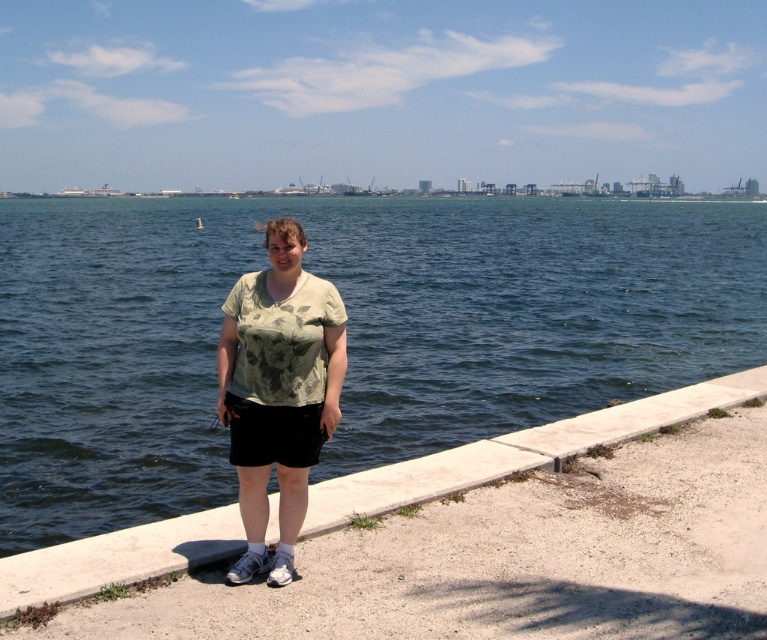
Is dark blue water at center closer to the viewer compared to concrete at center?

Yes.

Is dark blue water at center smaller than concrete at center?

Actually, dark blue water at center might be larger than concrete at center.

Who is more forward, (150, 445) or (713, 388)?

Point (713, 388)

The height and width of the screenshot is (640, 767). Find the location of `dark blue water at center`. dark blue water at center is located at coordinates (347, 332).

The height and width of the screenshot is (640, 767). What do you see at coordinates (347, 332) in the screenshot? I see `dark blue water at center` at bounding box center [347, 332].

In the scene shown: Which is above, dark blue water at center or green floral shirt at center?

dark blue water at center is higher up.

Is point (744, 324) less distant than point (236, 328)?

No, (744, 324) is further to viewer.

The image size is (767, 640). Identify the location of dark blue water at center. (347, 332).

Which is more to the left, concrete at center or green floral shirt at center?

From the viewer's perspective, green floral shirt at center appears more on the left side.

Between concrete at center and green floral shirt at center, which one has more height?

green floral shirt at center is taller.

Image resolution: width=767 pixels, height=640 pixels. What are the coordinates of `concrete at center` in the screenshot? It's located at (518, 451).

Identify the location of concrete at center. (518, 451).